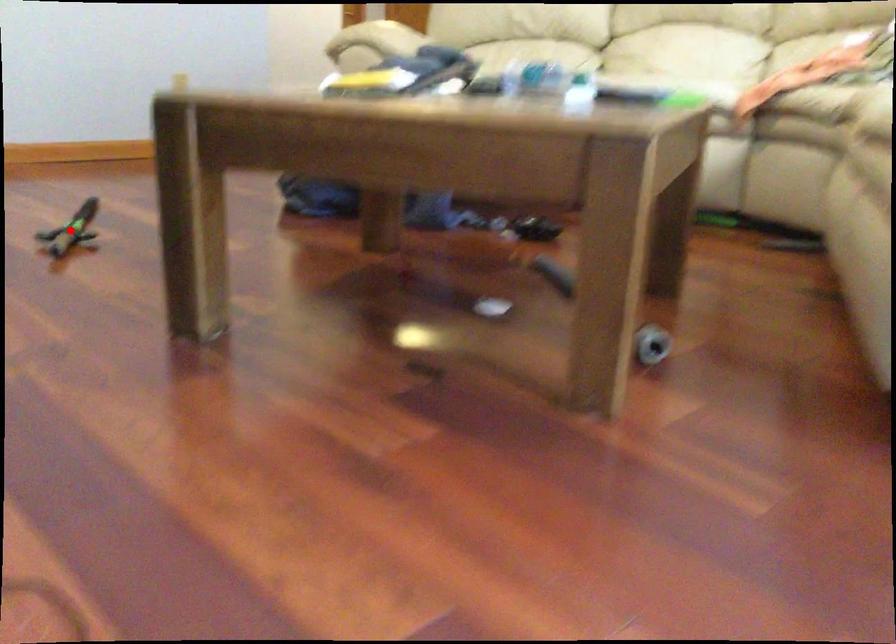
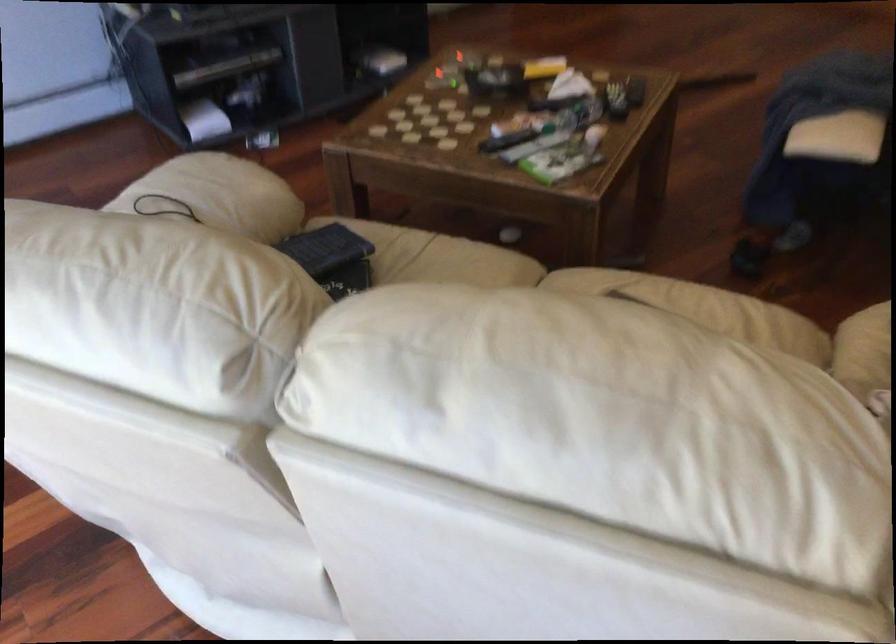
Question: I am providing you with two images of the same scene from different viewpoints. A red point is marked on the first image. Can you still see the location of the red point in image 2?

Choices:
 (A) Yes
 (B) No

Answer: (B)